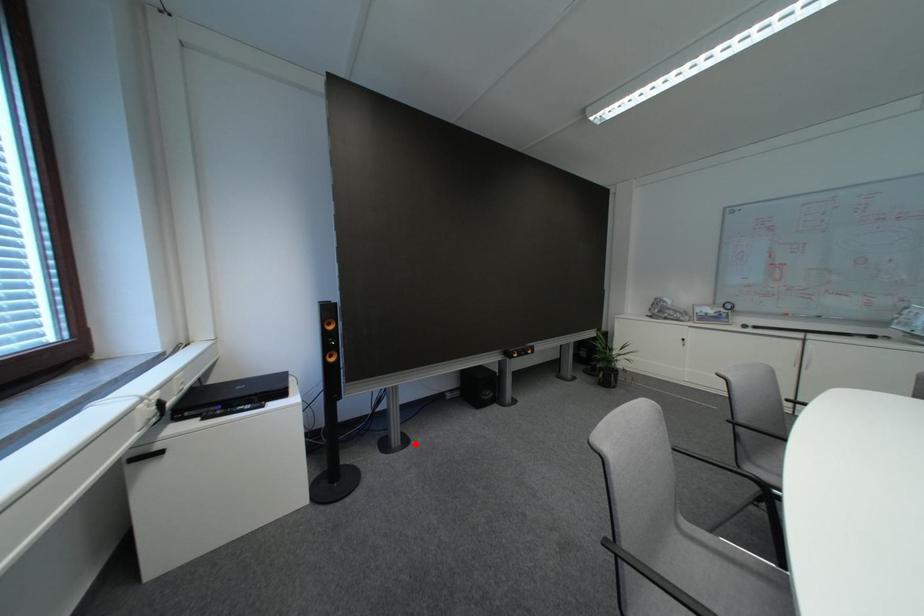
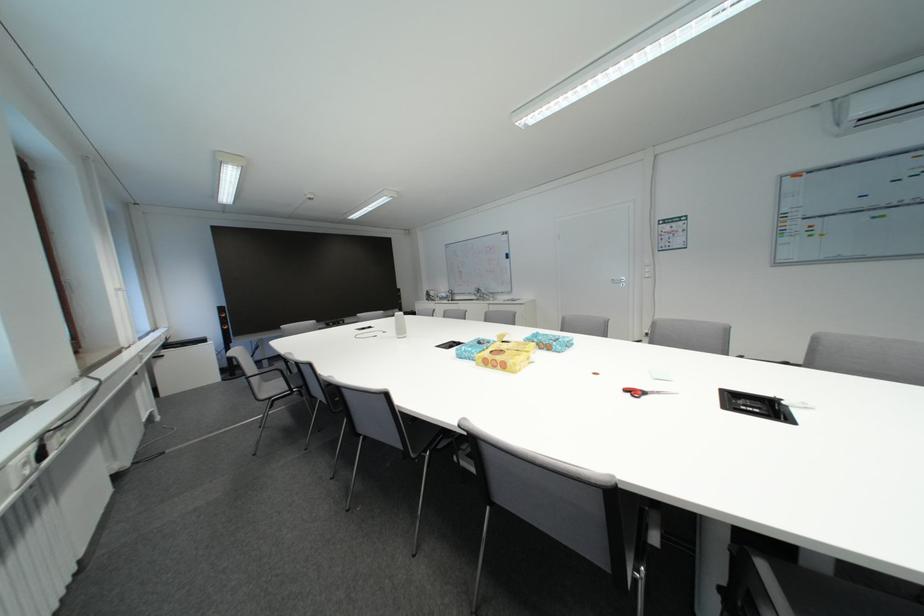
In the second image, find the point that corresponds to the highlighted location in the first image.

(282, 368)